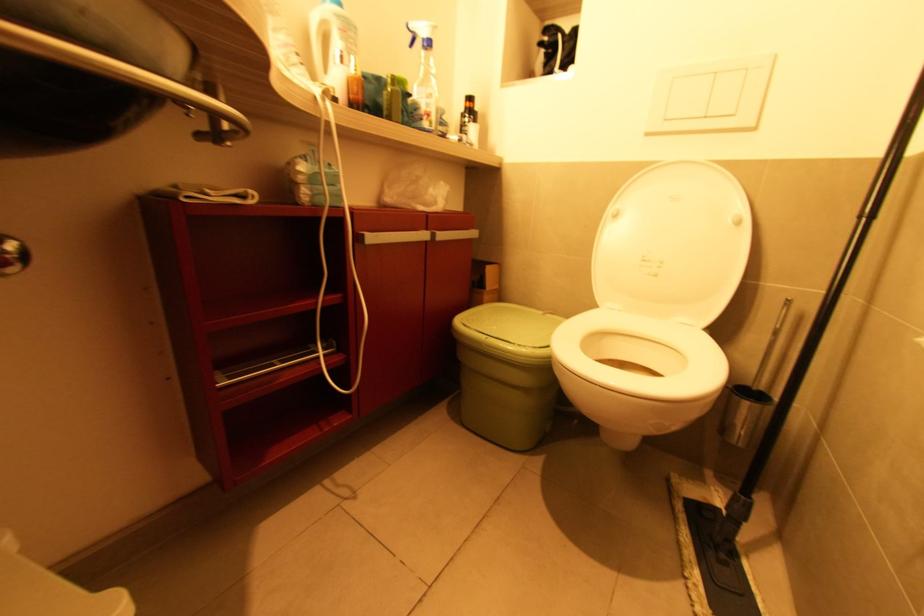
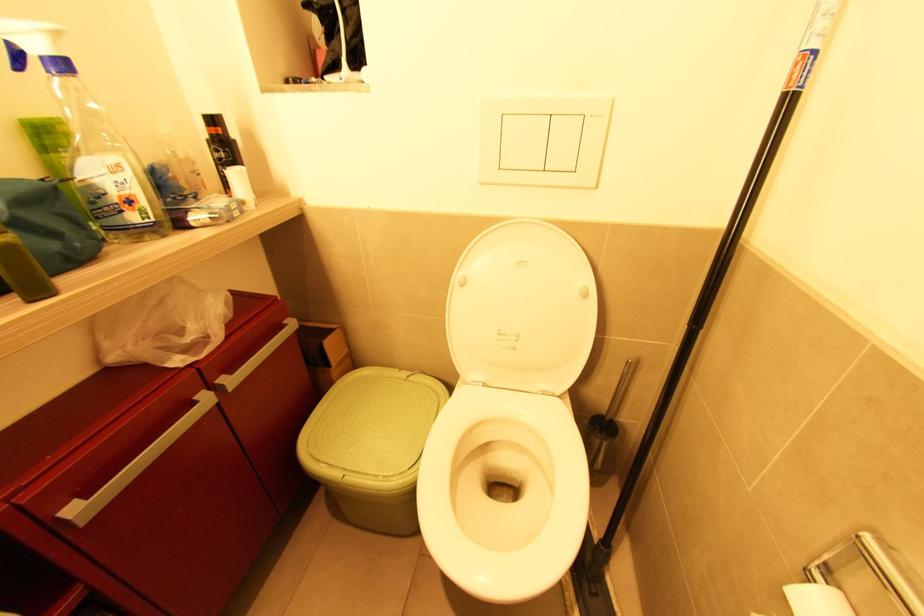
How did the camera likely rotate?

The camera rotated toward right-down.